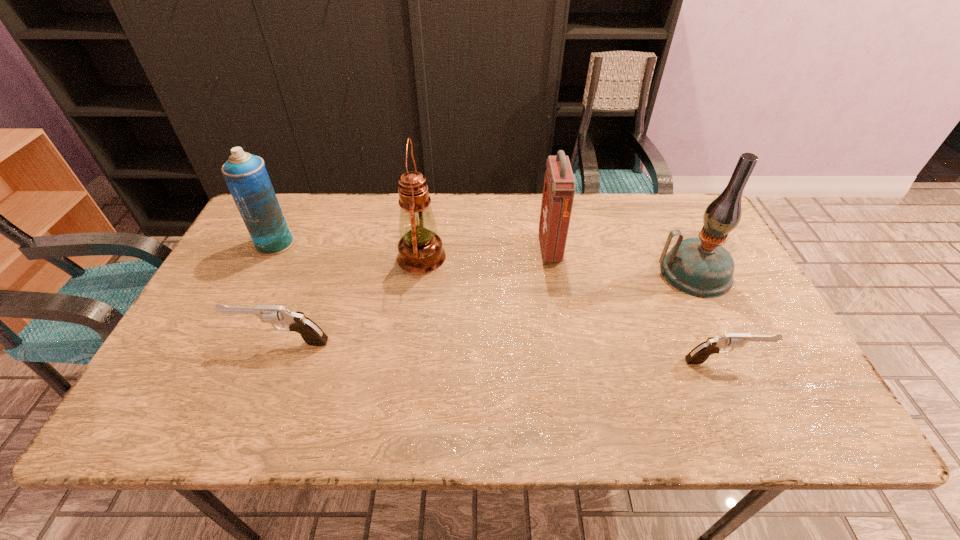
Locate an element on the screen. This screenshot has height=540, width=960. vacant spot for a new gun to ensure equal spacing is located at coordinates (498, 352).